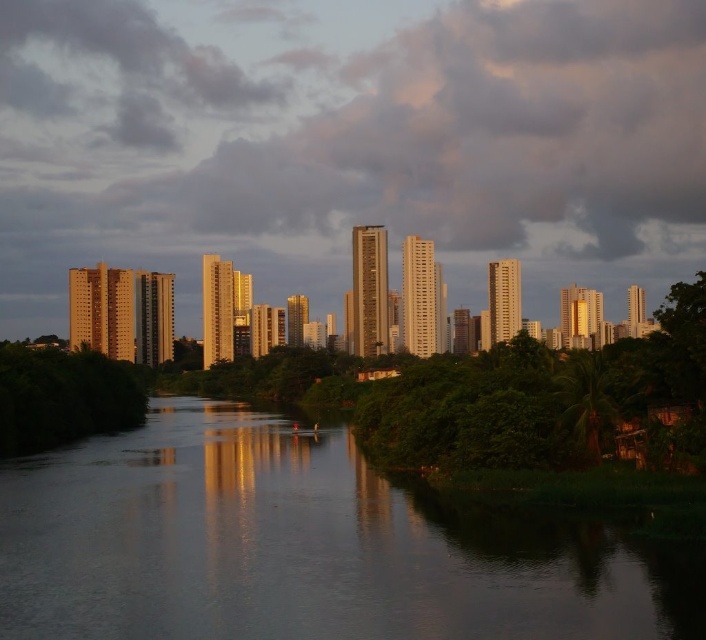
Describe the element at coordinates (349, 145) in the screenshot. I see `gray cloudy sky at upper center` at that location.

Find the location of a particular element. gray cloudy sky at upper center is located at coordinates (349, 145).

Is gray cloudy sky at upper center closer to camera compared to smooth reflective water at center?

No.

Who is more forward, (x=325, y=188) or (x=143, y=529)?

Positioned in front is point (x=143, y=529).

Identify the location of gray cloudy sky at upper center. The image size is (706, 640). (349, 145).

Which is below, smooth reflective water at center or green leafy tree at lower left?

Positioned lower is smooth reflective water at center.

Does smooth reflective water at center appear on the right side of green leafy tree at lower left?

Correct, you'll find smooth reflective water at center to the right of green leafy tree at lower left.

Which is in front, point (532, 628) or point (20, 355)?

Point (532, 628) is more forward.

I want to click on smooth reflective water at center, so click(x=301, y=547).